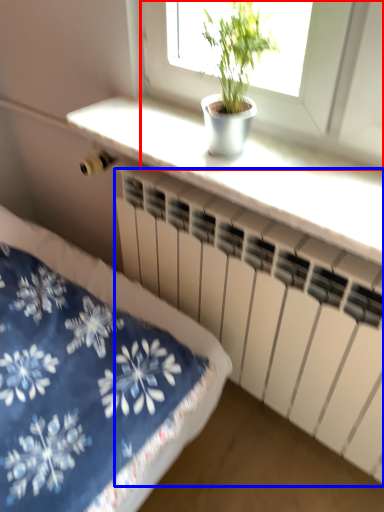
Question: Which of the following is the closest to the observer, window (highlighted by a red box) or radiator (highlighted by a blue box)?

Choices:
 (A) window
 (B) radiator

Answer: (A)